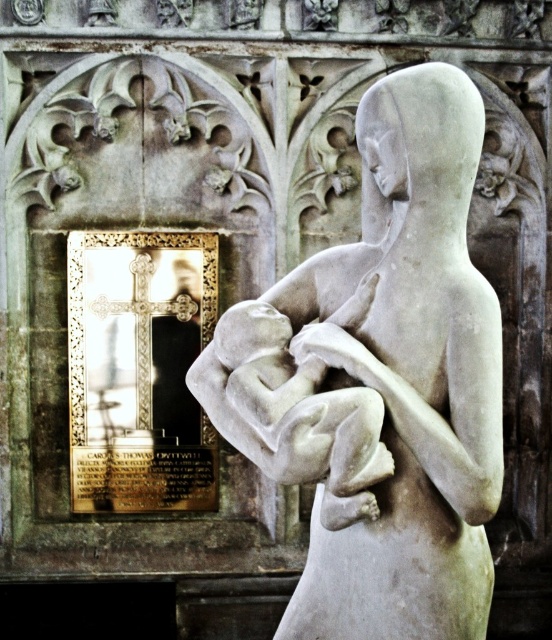
You are an art conservator assessing the placement of the white marble statue at center and the smooth white baby at center in the sculpture. Based on their sizes, which object would require more space for proper display?

The white marble statue at center requires more space for proper display since it has a larger size compared to the smooth white baby at center.

You are an art conservator examining the marble sculpture and its architectural backdrop. You notice two points marked on the image at coordinates point (473, 282) and point (355, 394). Based on their positions, which point is closer to the viewer?

Point (355, 394) is closer to the viewer because it is in front of point (473, 282).

You are an art conservator assessing the dimensions of the white marble statue at center and the smooth white baby at center. Which object is taller?

The white marble statue at center is taller than the smooth white baby at center.